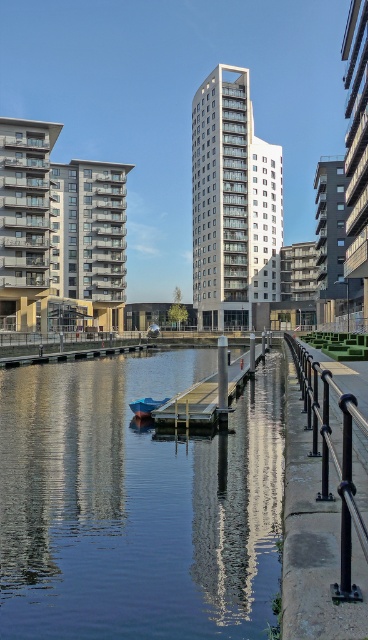
Is black metal railing at right taller than wooden dock at center?

No, black metal railing at right is not taller than wooden dock at center.

Is black metal railing at right to the left of wooden dock at center from the viewer's perspective?

Incorrect, black metal railing at right is not on the left side of wooden dock at center.

Does point (341, 496) lie behind point (236, 387)?

No.

Locate an element on the screen. black metal railing at right is located at coordinates (333, 458).

Can you confirm if smooth glass water at center is thinner than black metal railing at right?

No.

Is smooth glass water at center bigger than black metal railing at right?

Yes.

Who is more distant from viewer, (138,387) or (324,440)?

The point (138,387) is behind.

This screenshot has width=368, height=640. What are the coordinates of `smooth glass water at center` in the screenshot? It's located at (136, 504).

Is point (210, 403) positioned before point (150, 410)?

Yes, it is in front of point (150, 410).

Can you confirm if wooden dock at center is positioned to the left of blue glossy boat at center?

In fact, wooden dock at center is to the right of blue glossy boat at center.

Is point (195, 404) farther from camera compared to point (135, 410)?

No, (195, 404) is in front of (135, 410).

Where is `wooden dock at center`? The height and width of the screenshot is (640, 368). wooden dock at center is located at coordinates (203, 397).